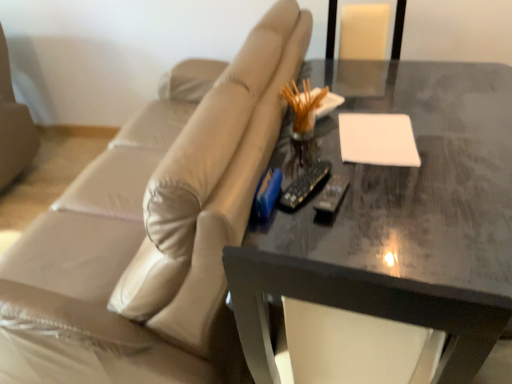
What do you see at coordinates (152, 236) in the screenshot? Image resolution: width=512 pixels, height=384 pixels. I see `beige leather couch at center` at bounding box center [152, 236].

Find the location of a particular element. The height and width of the screenshot is (384, 512). white matte notepad at upper right is located at coordinates (378, 139).

This screenshot has height=384, width=512. I want to click on black plastic remote at center, so click(304, 185).

In terms of size, does white matte notepad at upper right appear bigger or smaller than beige leather couch at center?

Considering their sizes, white matte notepad at upper right takes up less space than beige leather couch at center.

From a real-world perspective, is white matte notepad at upper right located higher than beige leather couch at center?

Yes, from a real-world perspective, white matte notepad at upper right is on top of beige leather couch at center.

Is white matte notepad at upper right far from beige leather couch at center?

No, white matte notepad at upper right is not far away from beige leather couch at center.

From the image's perspective, would you say white matte notepad at upper right is shown under beige leather couch at center?

No.

From a real-world perspective, does shiny dark gray table at center sit lower than beige leather couch at center?

Yes, from a real-world perspective, shiny dark gray table at center is below beige leather couch at center.

In the image, is shiny dark gray table at center positioned in front of or behind beige leather couch at center?

Visually, shiny dark gray table at center is located behind beige leather couch at center.

Where is `table behind the beige leather couch at center`? This screenshot has height=384, width=512. table behind the beige leather couch at center is located at coordinates click(397, 215).

From the image's perspective, which one is positioned higher, black plastic remote at center or white matte notepad at upper right?

white matte notepad at upper right.

Is black plastic remote at center aimed at white matte notepad at upper right?

No, black plastic remote at center is not turned towards white matte notepad at upper right.

Considering the relative sizes of black plastic remote at center and white matte notepad at upper right in the image provided, is black plastic remote at center taller than white matte notepad at upper right?

Yes.

Is beige leather couch at center completely or partially outside of black plastic remote at center?

beige leather couch at center lies outside black plastic remote at center's area.

How different are the orientations of beige leather couch at center and black plastic remote at center in degrees?

153 degrees separate the facing orientations of beige leather couch at center and black plastic remote at center.

Based on the photo, could you tell me if beige leather couch at center is turned towards black plastic remote at center?

No, beige leather couch at center is not oriented towards black plastic remote at center.

Considering the relative sizes of beige leather couch at center and black plastic remote at center in the image provided, is beige leather couch at center smaller than black plastic remote at center?

Incorrect, beige leather couch at center is not smaller in size than black plastic remote at center.

Is beige leather couch at center not within shiny dark gray table at center?

Indeed, beige leather couch at center is completely outside shiny dark gray table at center.

Where is `studio couch above the shiny dark gray table at center (from a real-world perspective)`? studio couch above the shiny dark gray table at center (from a real-world perspective) is located at coordinates (152, 236).

Considering the positions of point (176, 319) and point (470, 106), is point (176, 319) closer or farther from the camera than point (470, 106)?

Point (176, 319).

Is there a large distance between beige leather couch at center and shiny dark gray table at center?

beige leather couch at center is actually quite close to shiny dark gray table at center.

Locate an element on the screen. The image size is (512, 384). table in front of the white matte notepad at upper right is located at coordinates (397, 215).

Is white matte notepad at upper right positioned beyond the bounds of shiny dark gray table at center?

No, white matte notepad at upper right is not outside of shiny dark gray table at center.

Is white matte notepad at upper right to the right of shiny dark gray table at center from the viewer's perspective?

No, white matte notepad at upper right is not to the right of shiny dark gray table at center.

Is beige leather couch at center positioned with its back to white matte notepad at upper right?

Yes, beige leather couch at center is facing away from white matte notepad at upper right.

Does point (200, 352) come in front of point (358, 142)?

That is True.

Considering the sizes of objects beige leather couch at center and white matte notepad at upper right in the image provided, who is bigger, beige leather couch at center or white matte notepad at upper right?

beige leather couch at center is bigger.

This screenshot has height=384, width=512. Find the location of `studio couch below the white matte notepad at upper right (from the image's perspective)`. studio couch below the white matte notepad at upper right (from the image's perspective) is located at coordinates (152, 236).

Identify the location of studio couch that is on the left side of white matte notepad at upper right. (152, 236).

What are the coordinates of `table on the right of beige leather couch at center` in the screenshot? It's located at (397, 215).

Which object lies nearer to the anchor point beige leather couch at center, black plastic remote at center or shiny dark gray table at center?

shiny dark gray table at center is positioned closer to the anchor beige leather couch at center.

Estimate the real-world distances between objects in this image. Which object is closer to white matte notepad at upper right, beige leather couch at center or black plastic remote at center?

black plastic remote at center.

When comparing their distances from beige leather couch at center, does white matte notepad at upper right or shiny dark gray table at center seem closer?

shiny dark gray table at center is positioned closer to the anchor beige leather couch at center.

Which object lies nearer to the anchor point black plastic remote at center, beige leather couch at center or white matte notepad at upper right?

Among the two, white matte notepad at upper right is located nearer to black plastic remote at center.

From the image, which object appears to be farther from shiny dark gray table at center, black plastic remote at center or beige leather couch at center?

The object further to shiny dark gray table at center is beige leather couch at center.

Which object lies nearer to the anchor point beige leather couch at center, shiny dark gray table at center or white matte notepad at upper right?

shiny dark gray table at center lies closer to beige leather couch at center than the other object.

From the image, which object appears to be nearer to black plastic remote at center, shiny dark gray table at center or white matte notepad at upper right?

white matte notepad at upper right lies closer to black plastic remote at center than the other object.

Based on their spatial positions, is beige leather couch at center or shiny dark gray table at center further from black plastic remote at center?

Among the two, beige leather couch at center is located further to black plastic remote at center.

This screenshot has height=384, width=512. Find the location of `remote situated between beige leather couch at center and white matte notepad at upper right from left to right`. remote situated between beige leather couch at center and white matte notepad at upper right from left to right is located at coordinates (304, 185).

The image size is (512, 384). What are the coordinates of `remote between shiny dark gray table at center and white matte notepad at upper right in the front-back direction` in the screenshot? It's located at (304, 185).

What are the coordinates of `remote situated between beige leather couch at center and shiny dark gray table at center from left to right` in the screenshot? It's located at (304, 185).

Locate an element on the screen. The image size is (512, 384). notepad located between beige leather couch at center and shiny dark gray table at center in the left-right direction is located at coordinates (378, 139).